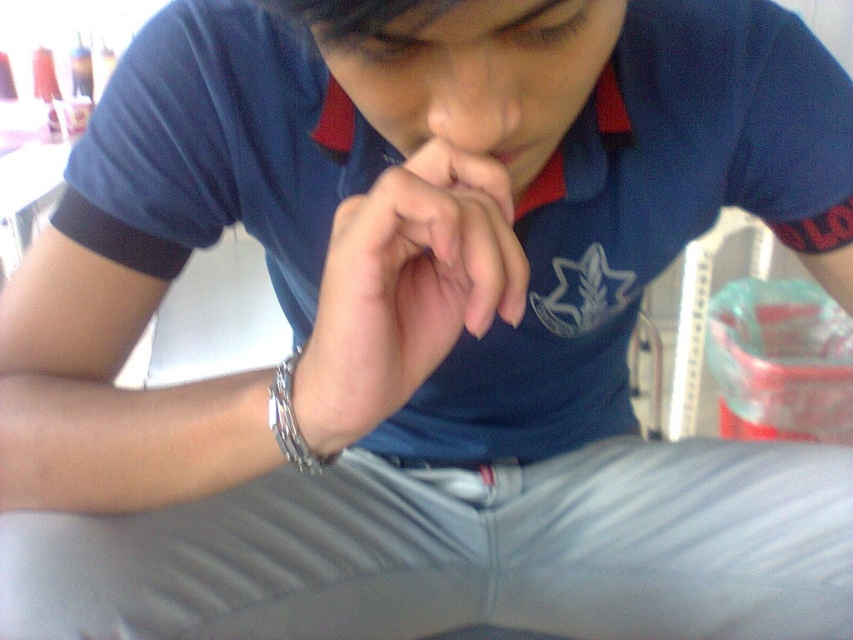
Question: Which point is closer to the camera taking this photo?

Choices:
 (A) (378, 348)
 (B) (299, 433)

Answer: (A)

Question: Is smooth skin hands at center below silver metallic bracelet at lower center?

Choices:
 (A) no
 (B) yes

Answer: (A)

Question: Which of the following is the closest to the observer?

Choices:
 (A) smooth skin hands at center
 (B) silver metallic bracelet at lower center

Answer: (A)

Question: Is smooth skin hands at center smaller than silver metallic bracelet at lower center?

Choices:
 (A) yes
 (B) no

Answer: (B)

Question: Is smooth skin hands at center to the right of silver metallic bracelet at lower center from the viewer's perspective?

Choices:
 (A) no
 (B) yes

Answer: (B)